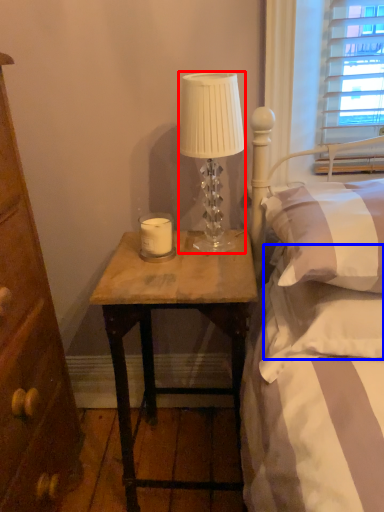
Question: Which object appears closest to the camera in this image, lamp (highlighted by a red box) or pillow (highlighted by a blue box)?

Choices:
 (A) lamp
 (B) pillow

Answer: (B)